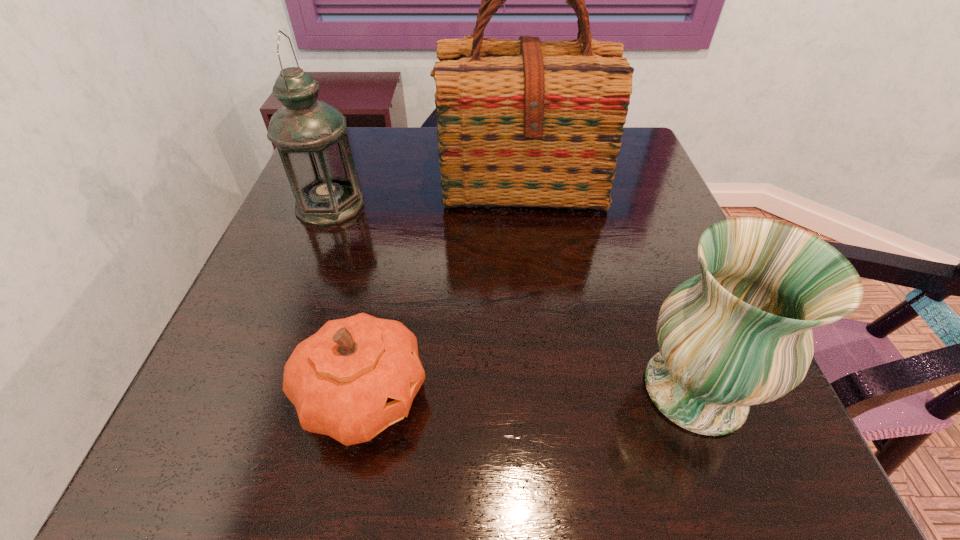
Find the location of a particular element. The image size is (960, 540). vacant space at the far right corner is located at coordinates click(x=625, y=143).

Image resolution: width=960 pixels, height=540 pixels. I want to click on free region at the near right corner of the desktop, so click(779, 470).

Find the location of a particular element. unoccupied position between the vase and the shopping bag is located at coordinates (608, 287).

Identify the location of free space between the shortest object and the second tallest object. (347, 300).

The height and width of the screenshot is (540, 960). Find the location of `unoccupied area between the second shortest object and the shopping bag`. unoccupied area between the second shortest object and the shopping bag is located at coordinates (608, 287).

The height and width of the screenshot is (540, 960). I want to click on free space between the vase and the shortest object, so click(x=529, y=393).

Image resolution: width=960 pixels, height=540 pixels. Identify the location of unoccupied area between the second tallest object and the shortest object. (347, 300).

Where is `vacant area between the oil lamp and the second shortest object`? The width and height of the screenshot is (960, 540). vacant area between the oil lamp and the second shortest object is located at coordinates (513, 298).

At what (x,y) coordinates should I click in order to perform the action: click on vacant space in between the vase and the shopping bag. Please return your answer as a coordinate pair (x, y). The height and width of the screenshot is (540, 960). Looking at the image, I should click on (608, 287).

Image resolution: width=960 pixels, height=540 pixels. In order to click on vacant area that lies between the oil lamp and the pumpkin in this screenshot , I will do `click(347, 300)`.